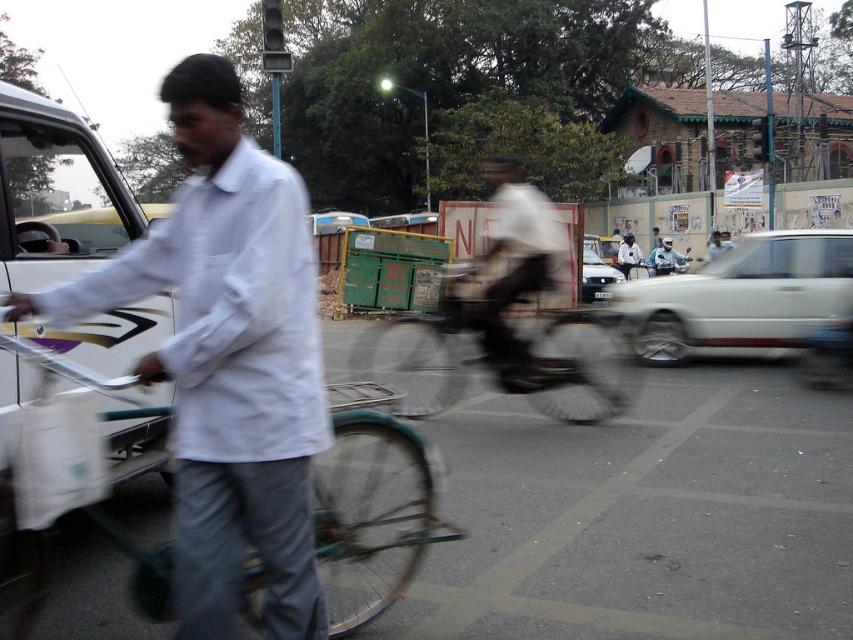
Is metallic silver bicycle at center to the left of white cotton shirt at center from the viewer's perspective?

Indeed, metallic silver bicycle at center is positioned on the left side of white cotton shirt at center.

In the scene shown: Which is above, metallic silver bicycle at center or white cotton shirt at center?

white cotton shirt at center is higher up.

This screenshot has height=640, width=853. What are the coordinates of `metallic silver bicycle at center` in the screenshot? It's located at (492, 360).

Between white matte shirt at center and white glossy car at right, which one has less height?

Standing shorter between the two is white matte shirt at center.

Is white matte shirt at center smaller than white glossy car at right?

Indeed, white matte shirt at center has a smaller size compared to white glossy car at right.

Is point (247, 300) in front of point (686, 294)?

Yes, it is.

I want to click on white matte shirt at center, so click(228, 358).

Is matte white car at center below white cotton shirt at center?

Indeed, matte white car at center is positioned under white cotton shirt at center.

Which is in front, point (581, 298) or point (625, 250)?

Point (581, 298) is more forward.

Image resolution: width=853 pixels, height=640 pixels. In order to click on matte white car at center in this screenshot , I will do `click(596, 276)`.